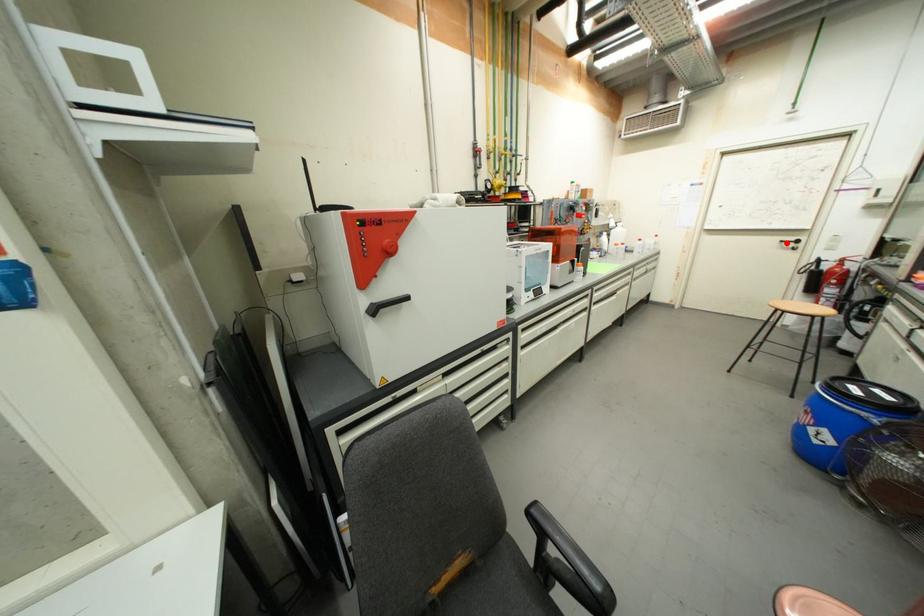
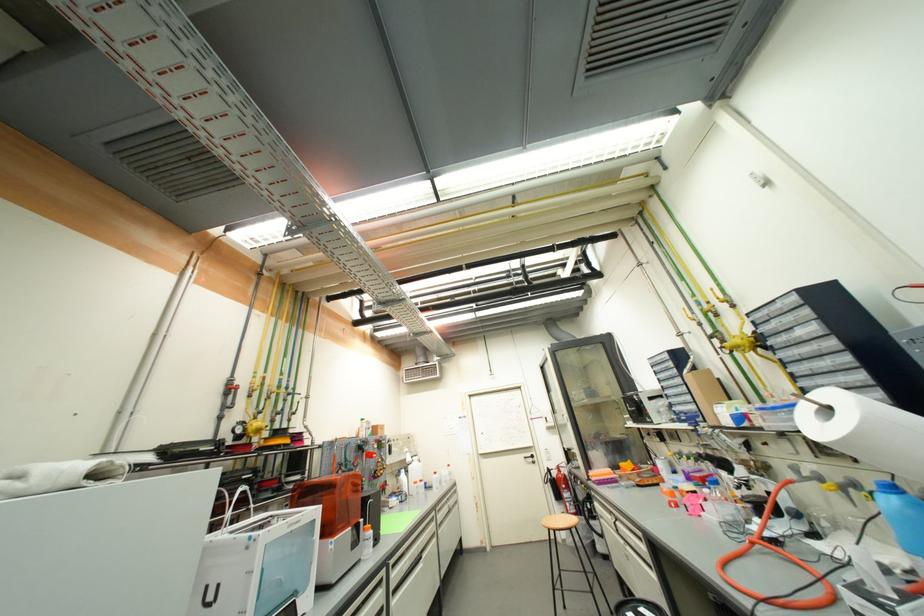
In the second image, find the point that corresponds to the highlighted location in the first image.

(530, 459)